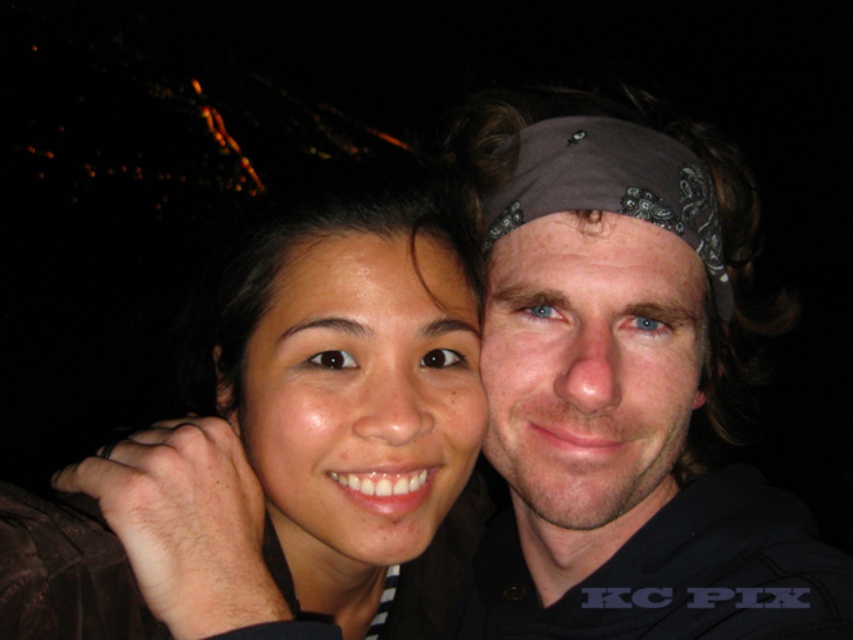
Who is lower down, matte black hair at center or brown bandana at center?

Positioned lower is matte black hair at center.

Does matte black hair at center have a lesser height compared to brown bandana at center?

Incorrect, matte black hair at center's height does not fall short of brown bandana at center's.

Is point (451, 380) closer to viewer compared to point (708, 250)?

Yes, point (451, 380) is closer to viewer.

The width and height of the screenshot is (853, 640). I want to click on matte black hair at center, so click(x=352, y=390).

Which of these two, gray bandana at center or matte black hair at center, stands shorter?

matte black hair at center is shorter.

Can you confirm if gray bandana at center is smaller than matte black hair at center?

Incorrect, gray bandana at center is not smaller in size than matte black hair at center.

Does point (621, 349) lie in front of point (467, 326)?

No, it is not.

The image size is (853, 640). What are the coordinates of `gray bandana at center` in the screenshot? It's located at (628, 412).

Does gray bandana at center have a greater height compared to brown bandana at center?

Correct, gray bandana at center is much taller as brown bandana at center.

Does gray bandana at center come in front of brown bandana at center?

That is True.

Who is more forward, (792, 609) or (502, 220)?

Point (792, 609) is more forward.

The width and height of the screenshot is (853, 640). In order to click on gray bandana at center in this screenshot , I will do `click(628, 412)`.